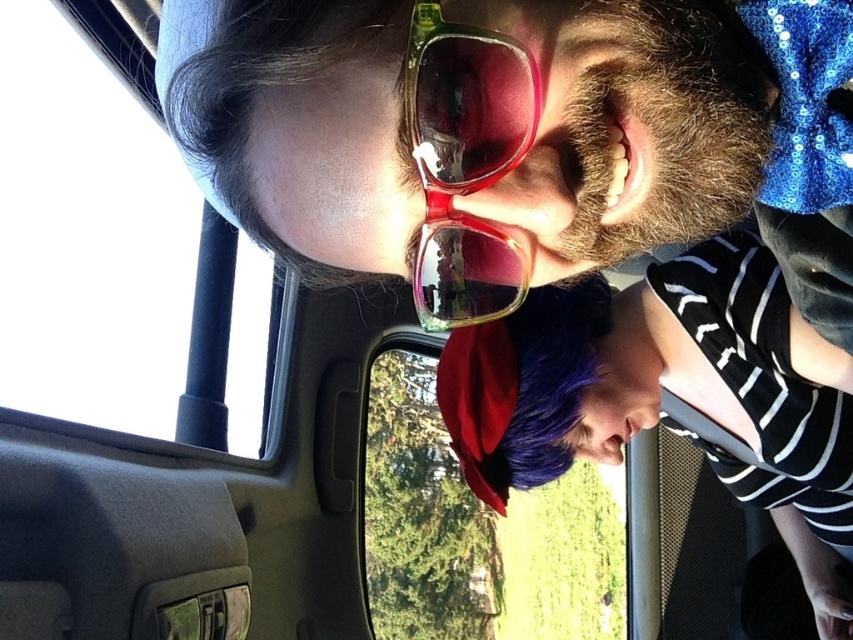
Question: Does transparent plastic car window at lower center appear over translucent plastic goggles at center?

Choices:
 (A) yes
 (B) no

Answer: (B)

Question: Can you confirm if transparent glass car window at upper left is wider than purple fabric cap at lower center?

Choices:
 (A) no
 (B) yes

Answer: (A)

Question: Among these points, which one is farthest from the camera?

Choices:
 (A) (753, 125)
 (B) (527, 115)
 (C) (714, 380)
 (D) (495, 580)

Answer: (D)

Question: Which of the following is the farthest from the observer?

Choices:
 (A) (604, 332)
 (B) (515, 109)
 (C) (424, 404)

Answer: (C)

Question: Does transparent glass car window at upper left have a lesser width compared to transparent plastic car window at lower center?

Choices:
 (A) no
 (B) yes

Answer: (B)

Question: Which point is closer to the camera?

Choices:
 (A) translucent plastic goggles at center
 (B) matte plastic sunglasses at upper center
 (C) transparent plastic car window at lower center

Answer: (A)